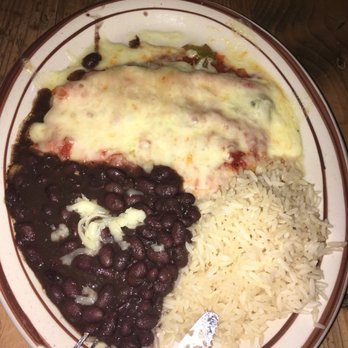
Locate an element on the screen. plate rim is located at coordinates click(x=338, y=307).